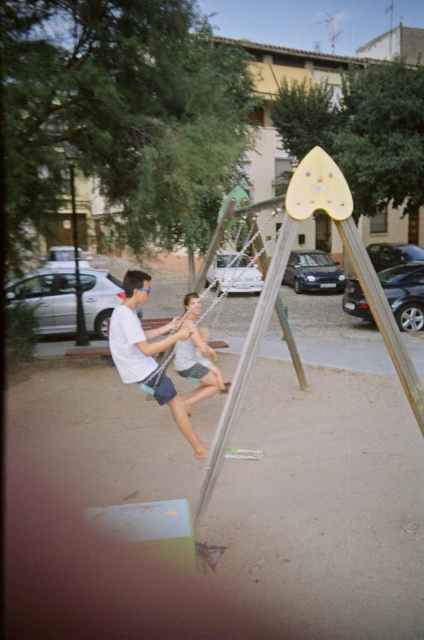
You are a parent watching your child play at the playground. You see the light blue denim shorts at center and the wooden swing at center. Which object is closer to you?

The light blue denim shorts at center is closer to you because the wooden swing at center is behind it.